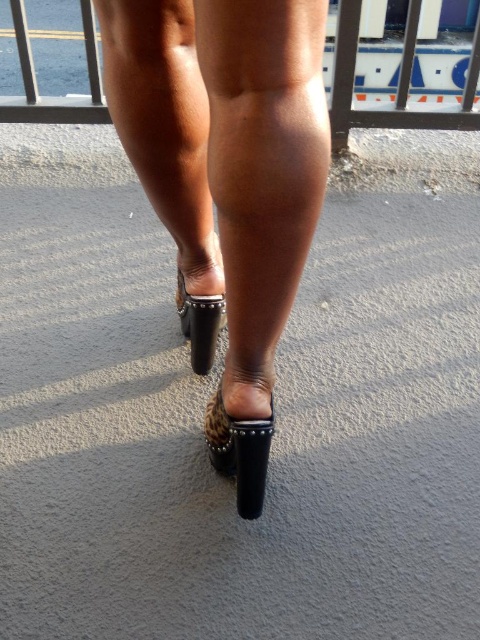
Does leather studded sandal at lower center appear on the left side of leather studded sandal at center?

Incorrect, leather studded sandal at lower center is not on the left side of leather studded sandal at center.

Does point (204, 438) come behind point (190, 301)?

No, (204, 438) is closer to viewer.

Find the location of `leather studded sandal at lower center`. leather studded sandal at lower center is located at coordinates (240, 452).

Between point (217, 410) and point (31, 49), which one is positioned in front?

Point (217, 410)

Does leather high-heeled shoe at center have a smaller size compared to metallic silver rail at upper center?

Yes.

Is point (235, 432) positioned before point (338, 68)?

Yes, point (235, 432) is in front of point (338, 68).

Image resolution: width=480 pixels, height=640 pixels. Identify the location of leather high-heeled shoe at center. (260, 204).

Can you confirm if leather high-heeled shoe at center is thinner than leather studded sandal at center?

No, leather high-heeled shoe at center is not thinner than leather studded sandal at center.

I want to click on leather high-heeled shoe at center, so click(x=260, y=204).